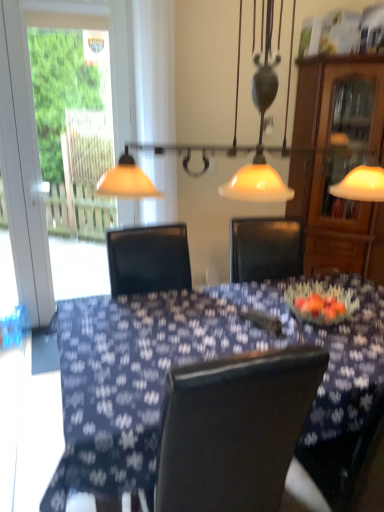
Question: Does matte glass pendant light at upper center have a lesser height compared to blue fabric table at center?

Choices:
 (A) yes
 (B) no

Answer: (B)

Question: Is matte glass pendant light at upper center not near blue fabric table at center?

Choices:
 (A) no
 (B) yes

Answer: (B)

Question: Can you see matte glass pendant light at upper center touching blue fabric table at center?

Choices:
 (A) yes
 (B) no

Answer: (B)

Question: Does matte glass pendant light at upper center appear on the left side of blue fabric table at center?

Choices:
 (A) yes
 (B) no

Answer: (B)

Question: Considering the relative sizes of matte glass pendant light at upper center and blue fabric table at center in the image provided, is matte glass pendant light at upper center smaller than blue fabric table at center?

Choices:
 (A) yes
 (B) no

Answer: (A)

Question: Is point (374, 287) positioned closer to the camera than point (33, 160)?

Choices:
 (A) closer
 (B) farther

Answer: (A)

Question: Is blue fabric table at center to the left or to the right of transparent glass screen door at left in the image?

Choices:
 (A) right
 (B) left

Answer: (A)

Question: In terms of height, does blue fabric table at center look taller or shorter compared to transparent glass screen door at left?

Choices:
 (A) short
 (B) tall

Answer: (A)

Question: Is blue fabric table at center spatially inside transparent glass screen door at left, or outside of it?

Choices:
 (A) inside
 (B) outside

Answer: (B)

Question: In terms of size, does wooden cabinet at right appear bigger or smaller than matte glass pendant light at upper center?

Choices:
 (A) small
 (B) big

Answer: (B)

Question: From their relative heights in the image, would you say wooden cabinet at right is taller or shorter than matte glass pendant light at upper center?

Choices:
 (A) short
 (B) tall

Answer: (B)

Question: From a real-world perspective, relative to matte glass pendant light at upper center, is wooden cabinet at right vertically above or below?

Choices:
 (A) below
 (B) above

Answer: (A)

Question: Choose the correct answer: Is wooden cabinet at right inside matte glass pendant light at upper center or outside it?

Choices:
 (A) outside
 (B) inside

Answer: (A)

Question: Do you think matte glass pendant light at upper center is within wooden cabinet at right, or outside of it?

Choices:
 (A) outside
 (B) inside

Answer: (A)

Question: From a real-world perspective, relative to wooden cabinet at right, is matte glass pendant light at upper center vertically above or below?

Choices:
 (A) above
 (B) below

Answer: (A)